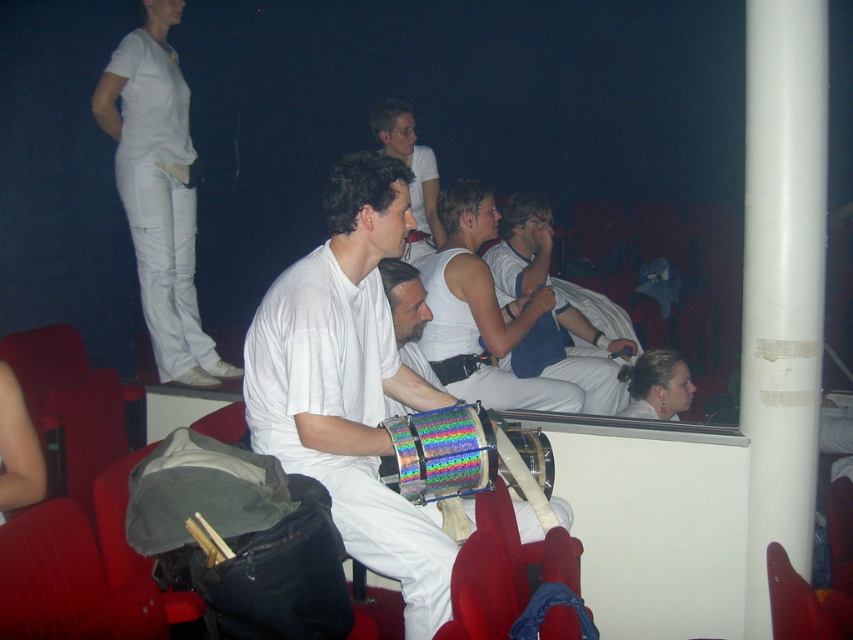
Does white fabric at center have a greater width compared to white matte tank top at center?

Yes, white fabric at center is wider than white matte tank top at center.

Identify the location of white fabric at center. The image size is (853, 640). (552, 310).

Does white fabric tank top at center have a greater width compared to white matte tank top at center?

Correct, the width of white fabric tank top at center exceeds that of white matte tank top at center.

Based on the photo, does white fabric tank top at center have a lesser width compared to white matte tank top at center?

No, white fabric tank top at center is not thinner than white matte tank top at center.

Between point (534, 400) and point (410, 147), which one is positioned in front?

Positioned in front is point (534, 400).

The image size is (853, 640). I want to click on white fabric tank top at center, so click(480, 314).

Who is shorter, white cotton shirt at upper left or white fabric tank top at center?

Standing shorter between the two is white fabric tank top at center.

Is point (140, 244) closer to viewer compared to point (480, 200)?

Yes.

The width and height of the screenshot is (853, 640). What are the coordinates of `white cotton shirt at upper left` in the screenshot? It's located at (160, 192).